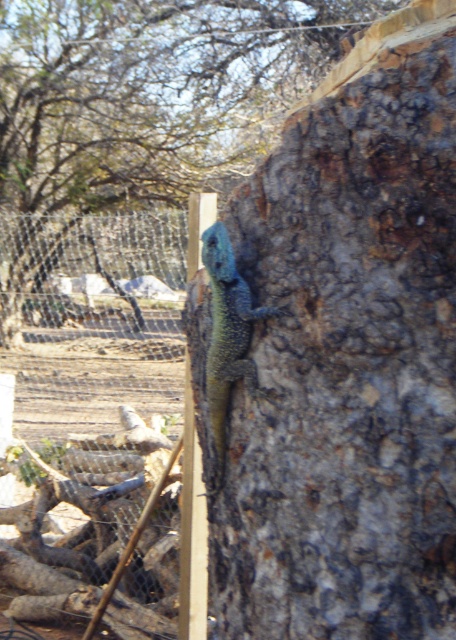
Which is below, wire mesh fence at left or blue-green scaly lizard at center?

blue-green scaly lizard at center is below.

Who is taller, wire mesh fence at left or blue-green scaly lizard at center?

Standing taller between the two is wire mesh fence at left.

Identify the location of wire mesh fence at left. (87, 396).

How far apart are smooth bark tree trunk at center and wire mesh fence at left?

The distance of smooth bark tree trunk at center from wire mesh fence at left is 8.76 feet.

Which is behind, point (301, 301) or point (174, 566)?

The point (174, 566) is more distant.

This screenshot has width=456, height=640. I want to click on smooth bark tree trunk at center, so click(x=348, y=356).

Who is higher up, smooth bark tree trunk at center or smooth bark tree at center?

smooth bark tree at center

Who is taller, smooth bark tree trunk at center or smooth bark tree at center?

Standing taller between the two is smooth bark tree at center.

Between point (331, 326) and point (140, 1), which one is positioned in front?

Point (331, 326) is more forward.

You are a GUI agent. You are given a task and a screenshot of the screen. Output one action in this format:
    pyautogui.click(x=<x>, y=<y>)
    Task: Click on the smooth bark tree trunk at center
    This screenshot has height=640, width=456.
    Given the screenshot: What is the action you would take?
    pyautogui.click(x=348, y=356)